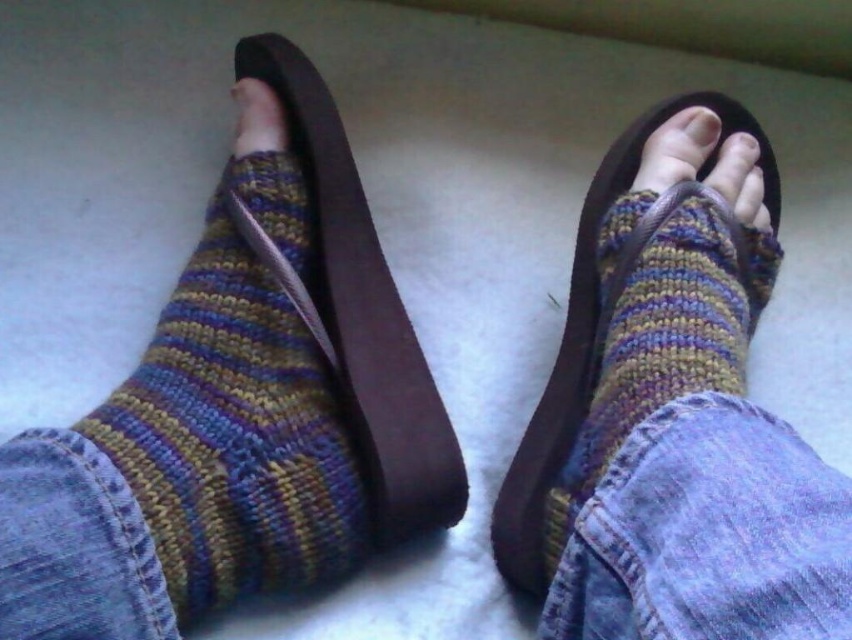
Question: Does matte brown leather toe at center appear under matte brown toe at center?

Choices:
 (A) no
 (B) yes

Answer: (B)

Question: Considering the real-world distances, which object is farthest from the matte brown toe at center?

Choices:
 (A) multicolored knitted sock at left
 (B) knitted wool socks at center
 (C) matte brown leather toe at center

Answer: (A)

Question: Among these objects, which one is nearest to the camera?

Choices:
 (A) knitted wool sock at center
 (B) matte brown leather toe at center

Answer: (A)

Question: Does multicolored knitted sock at left have a greater width compared to matte brown leather toe at center?

Choices:
 (A) no
 (B) yes

Answer: (B)

Question: Which point appears closest to the camera in this image?

Choices:
 (A) (744, 205)
 (B) (705, 141)

Answer: (A)

Question: Does knitted wool socks at center appear on the right side of matte brown leather toe at center?

Choices:
 (A) yes
 (B) no

Answer: (B)